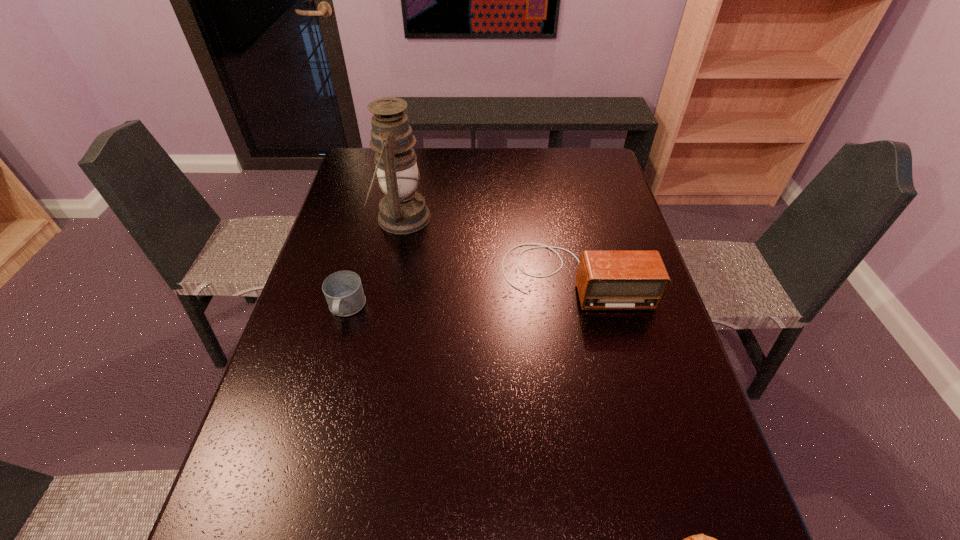
In order to click on oil lamp in this screenshot , I will do `click(403, 210)`.

Image resolution: width=960 pixels, height=540 pixels. What are the coordinates of `the tallest object` in the screenshot? It's located at (403, 210).

What are the coordinates of `radio receiver` in the screenshot? It's located at (606, 280).

Locate an element on the screen. The width and height of the screenshot is (960, 540). mug is located at coordinates (343, 290).

The width and height of the screenshot is (960, 540). What are the coordinates of `vacant space positioned 0.170m on the right of the tallest object` in the screenshot? It's located at (484, 218).

In order to click on free point located on the front-facing side of the radio receiver in this screenshot , I will do `click(585, 328)`.

Where is `vacant space located 0.180m on the side of the third tallest object with the handle`? vacant space located 0.180m on the side of the third tallest object with the handle is located at coordinates (324, 393).

Find the location of `oil lamp present at the left edge`. oil lamp present at the left edge is located at coordinates [x=403, y=210].

Find the location of a particular element. mug that is at the left edge is located at coordinates click(x=343, y=290).

Where is `object at the right edge`? The width and height of the screenshot is (960, 540). object at the right edge is located at coordinates (606, 280).